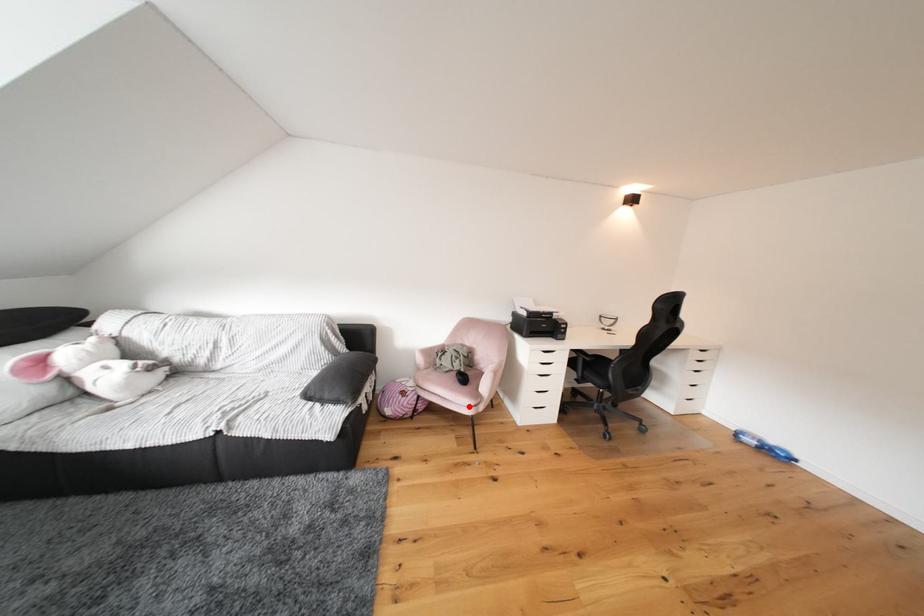
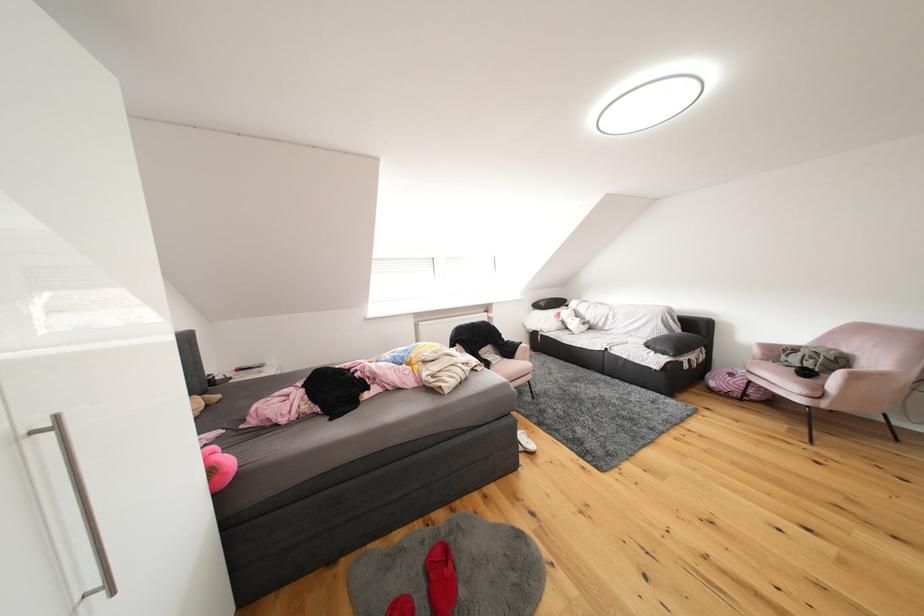
Question: I am providing you with two images of the same scene from different viewpoints. Image1 has a red point marked. In image2, the corresponding 3D location appears at what relative position? Reply with the corresponding letter.

Choices:
 (A) Closer
 (B) Farther

Answer: (A)